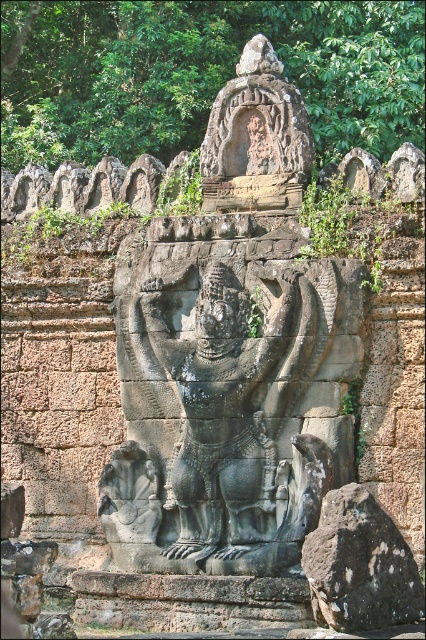
You are an archaeologist examining the ancient stone sculpture. You notice a specific point marked at coordinates (229,401). Which object in the scene does this point belong to?

The point at coordinates (229,401) is located on the black stone deity at center.

Based on the coordinates provided, where is the black stone deity at center located in the image?

The black stone deity at center is located at the 2D coordinates point (229, 401) in the image.